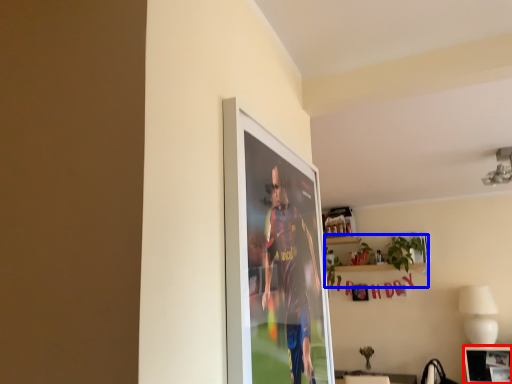
Question: Which object is further to the camera taking this photo, picture frame (highlighted by a red box) or houseplant (highlighted by a blue box)?

Choices:
 (A) picture frame
 (B) houseplant

Answer: (B)